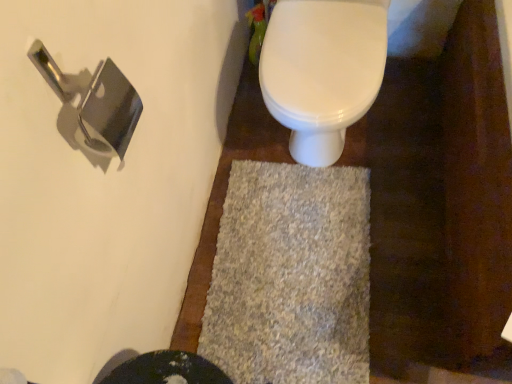
Find the location of a particular element. The height and width of the screenshot is (384, 512). vacant area that is situated to the right of gray shaggy bath mat at center is located at coordinates (406, 213).